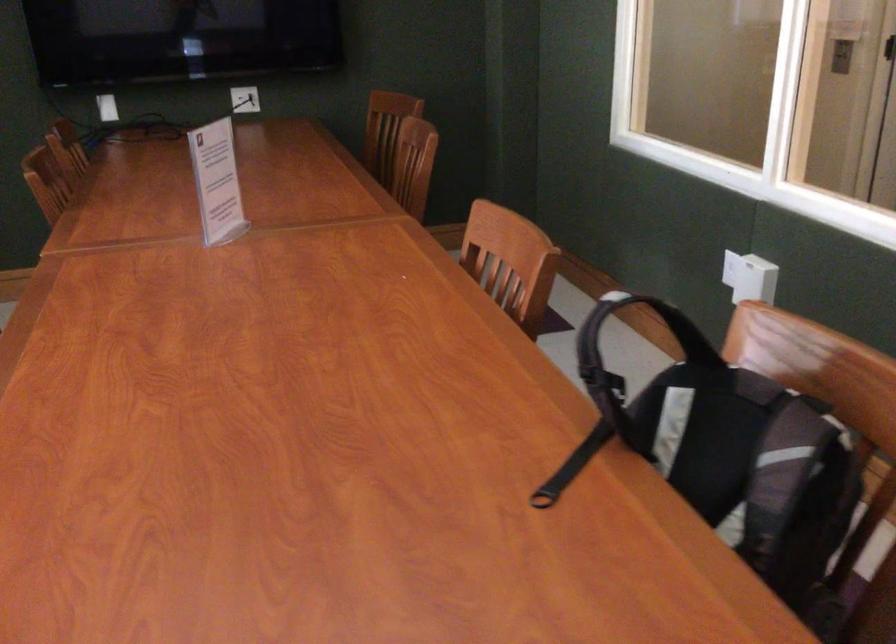
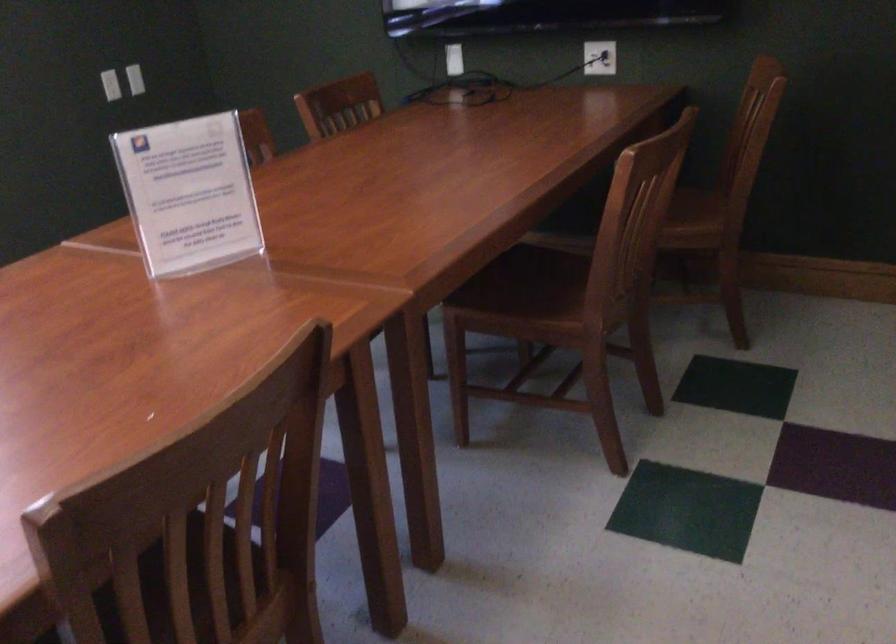
Find the pixel in the second image that matches [259,93] in the first image.

(599, 58)